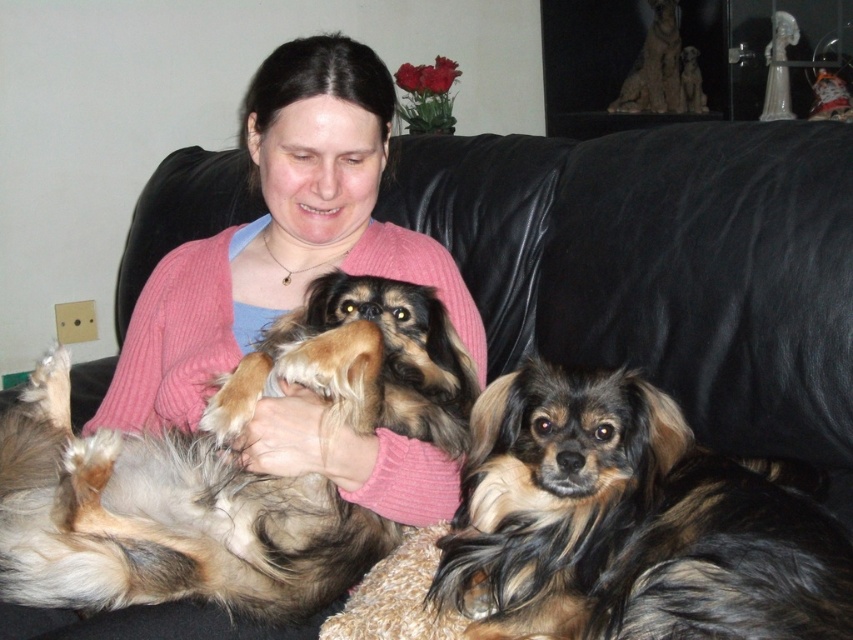
You are a photographer setting up a photo shoot in this living room. You need to place a small stool between the shaggy brown dog at center and the shaggy brown fur at right. Which side of the stool should face the larger object?

The stool should face the shaggy brown dog at center because it is larger than the shaggy brown fur at right.